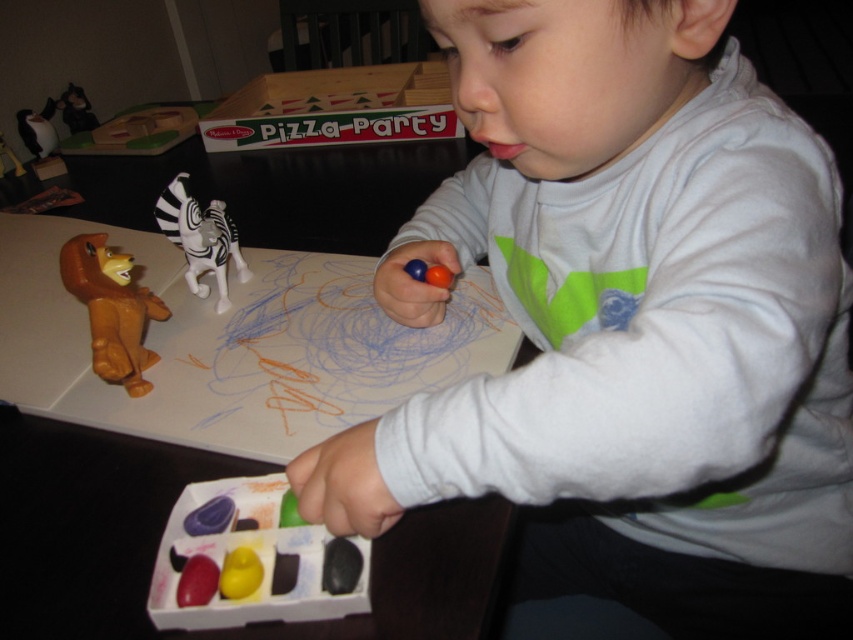
Question: Can you confirm if white matte shirt at center is positioned above smooth plastic crayons at lower center?

Choices:
 (A) no
 (B) yes

Answer: (B)

Question: Does white plastic table at center come behind smooth plastic crayons at lower center?

Choices:
 (A) yes
 (B) no

Answer: (B)

Question: Which point is closer to the camera taking this photo?

Choices:
 (A) (120, 372)
 (B) (149, 518)
 (C) (218, 276)
 (D) (267, 115)

Answer: (B)

Question: Which of the following is the farthest from the observer?

Choices:
 (A) (65, 602)
 (B) (767, 140)
 (C) (363, 99)

Answer: (C)

Question: Which of the following is the closest to the observer?

Choices:
 (A) white matte shirt at center
 (B) brown rubber lion at left
 (C) wooden pizza party box at center

Answer: (A)

Question: Considering the relative positions of white plastic table at center and smooth plastic crayons at lower center in the image provided, where is white plastic table at center located with respect to smooth plastic crayons at lower center?

Choices:
 (A) below
 (B) above

Answer: (B)